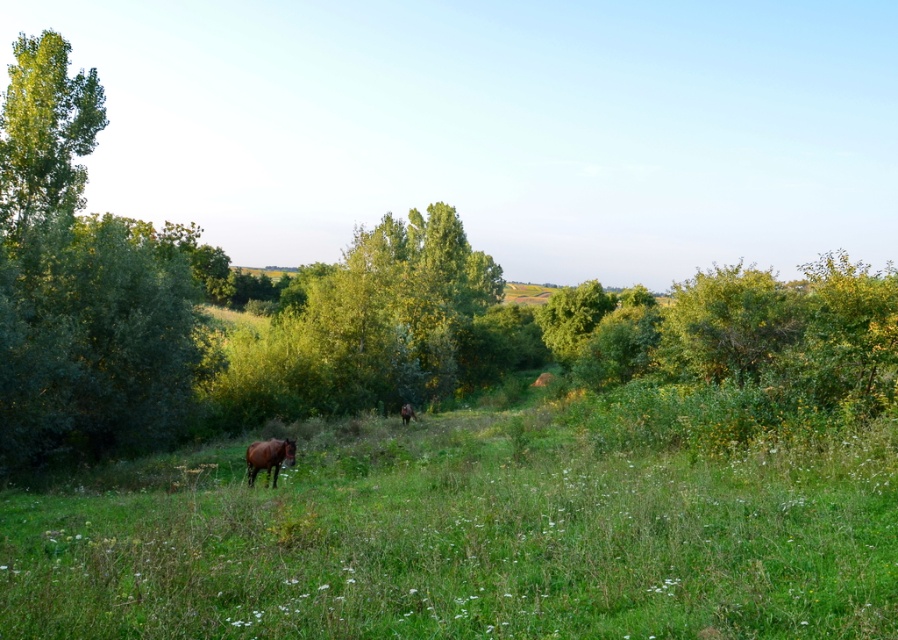
Between green leafy tree at upper left and brown glossy horse at lower left, which one is positioned lower?

brown glossy horse at lower left

Does point (42, 122) come behind point (291, 449)?

That is True.

Is point (11, 216) positioned before point (273, 460)?

No.

Find the location of `green leafy tree at upper left`. green leafy tree at upper left is located at coordinates (43, 132).

Who is positioned more to the left, green grass at lower center or green leafy tree at upper left?

Positioned to the left is green leafy tree at upper left.

Is green grass at lower center further to camera compared to green leafy tree at upper left?

No, green grass at lower center is in front of green leafy tree at upper left.

What do you see at coordinates (467, 538) in the screenshot?
I see `green grass at lower center` at bounding box center [467, 538].

I want to click on green grass at lower center, so click(x=467, y=538).

Is green leafy tree at left thinner than brown glossy horse at lower left?

No, green leafy tree at left is not thinner than brown glossy horse at lower left.

Who is more forward, (31,353) or (249,460)?

Point (249,460)

Locate an element on the screen. green leafy tree at left is located at coordinates (94, 337).